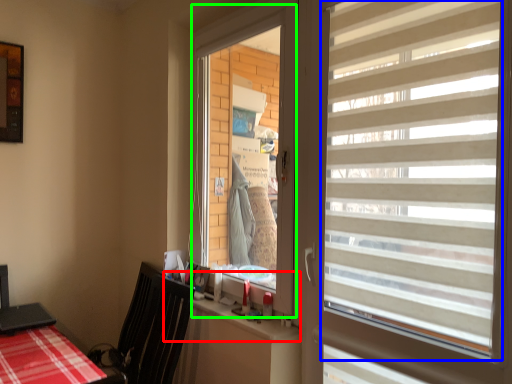
Question: Considering the real-world distances, which object is farthest from counter top (highlighted by a red box)? window blind (highlighted by a blue box) or window screen (highlighted by a green box)?

Choices:
 (A) window blind
 (B) window screen

Answer: (A)